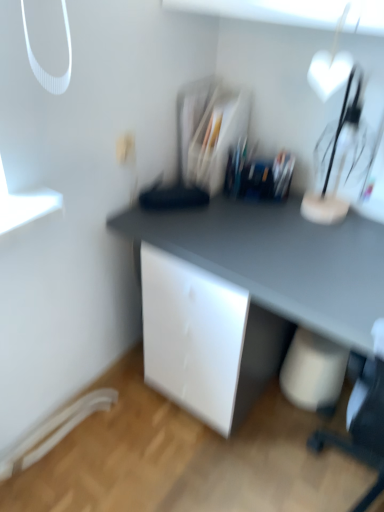
Identify the location of vacant space underneath white glossy heart-shaped object at upper right (from a real-world perspective). (324, 213).